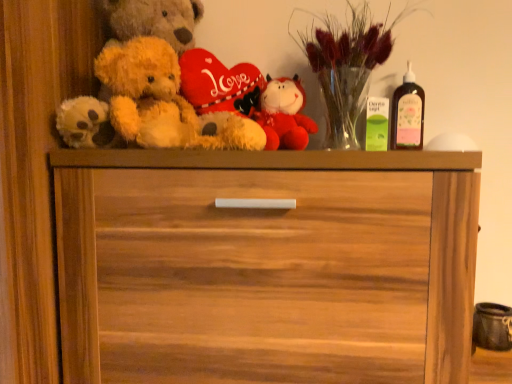
Question: Is point (278, 100) positioned closer to the camera than point (129, 8)?

Choices:
 (A) farther
 (B) closer

Answer: (A)

Question: Based on their sizes in the image, would you say fluffy red plush toy at center is bigger or smaller than fluffy beige teddy bear at left?

Choices:
 (A) big
 (B) small

Answer: (B)

Question: Which object is positioned farthest from the wooden chest of drawers at center?

Choices:
 (A) fluffy beige teddy bear at left
 (B) pink glass bottle at upper right
 (C) fluffy red plush toy at center
 (D) translucent glass vase at upper right

Answer: (B)

Question: Estimate the real-world distances between objects in this image. Which object is closer to the wooden chest of drawers at center?

Choices:
 (A) fluffy beige teddy bear at left
 (B) fluffy red plush toy at center
 (C) translucent glass vase at upper right
 (D) pink glass bottle at upper right

Answer: (A)